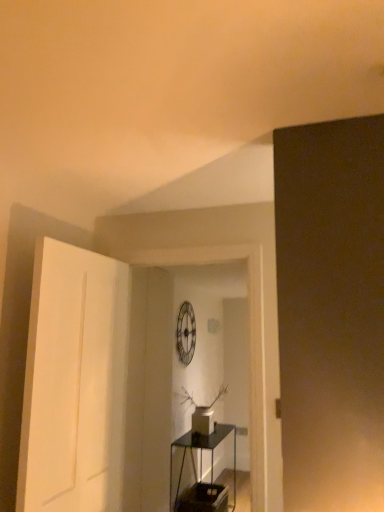
At what (x,y) coordinates should I click in order to perform the action: click on transparent glass table at center. Please return your answer as a coordinate pair (x, y). The height and width of the screenshot is (512, 384). Looking at the image, I should click on tap(200, 454).

What do you see at coordinates (200, 454) in the screenshot? I see `transparent glass table at center` at bounding box center [200, 454].

What do you see at coordinates (74, 382) in the screenshot? I see `white matte door at left` at bounding box center [74, 382].

In order to face white matte door at left, should I rotate leftwards or rightwards?

Turn left by 14.114 degrees to look at white matte door at left.

What is the approximate width of white matte door at left?

6.76 inches.

You are a GUI agent. You are given a task and a screenshot of the screen. Output one action in this format:
    pyautogui.click(x=<x>, y=<y>)
    Task: Click on the white matte door at left
    Image resolution: width=384 pixels, height=512 pixels.
    Given the screenshot: What is the action you would take?
    pyautogui.click(x=74, y=382)

What is the approximate height of white matte door at left?

white matte door at left is 4.36 feet in height.

The height and width of the screenshot is (512, 384). Find the location of `transparent glass table at center`. transparent glass table at center is located at coordinates pyautogui.click(x=200, y=454).

Between white matte door at left and transparent glass table at center, which one appears on the left side from the viewer's perspective?

Positioned to the left is white matte door at left.

Who is more distant, white matte door at left or transparent glass table at center?

transparent glass table at center is further from the camera.

Which is behind, point (119, 313) or point (192, 455)?

The point (192, 455) is more distant.

From the image's perspective, which is above, white matte door at left or transparent glass table at center?

white matte door at left.

From a real-world perspective, is white matte door at left physically below transparent glass table at center?

Incorrect, from a real-world perspective, white matte door at left is higher than transparent glass table at center.

Can you confirm if white matte door at left is wider than transparent glass table at center?

In fact, white matte door at left might be narrower than transparent glass table at center.

From the picture: Considering the sizes of objects white matte door at left and transparent glass table at center in the image provided, who is taller, white matte door at left or transparent glass table at center?

white matte door at left.

From the picture: Based on their sizes in the image, would you say white matte door at left is bigger or smaller than transparent glass table at center?

In the image, white matte door at left appears to be smaller than transparent glass table at center.

Is white matte door at left surrounding transparent glass table at center?

No, transparent glass table at center is not a part of white matte door at left.

Can you see white matte door at left touching transparent glass table at center?

No, white matte door at left is not making contact with transparent glass table at center.

Is white matte door at left facing towards transparent glass table at center?

No, white matte door at left is not aimed at transparent glass table at center.

Looking at this image, what's the angular difference between white matte door at left and transparent glass table at center's facing directions?

There is a 2.21-degree angle between the facing directions of white matte door at left and transparent glass table at center.

Locate an element on the screen. door above the transparent glass table at center (from the image's perspective) is located at coordinates (74, 382).

Considering the positions of objects transparent glass table at center and white matte door at left in the image provided, who is more to the left, transparent glass table at center or white matte door at left?

Positioned to the left is white matte door at left.

Which is behind, transparent glass table at center or white matte door at left?

transparent glass table at center is further away from the camera.

Considering the positions of points (191, 452) and (70, 445), is point (191, 452) closer to camera compared to point (70, 445)?

No, (191, 452) is further to viewer.

From the image's perspective, is transparent glass table at center located above white matte door at left?

No, from the image's perspective, transparent glass table at center is not on top of white matte door at left.

From a real-world perspective, which object rests below the other?

In real-world perspective, transparent glass table at center is lower.

Is transparent glass table at center wider than white matte door at left?

Yes.

Considering the sizes of objects transparent glass table at center and white matte door at left in the image provided, who is taller, transparent glass table at center or white matte door at left?

white matte door at left is taller.

Who is smaller, transparent glass table at center or white matte door at left?

white matte door at left is smaller.

Is transparent glass table at center completely or partially outside of white matte door at left?

Yes, transparent glass table at center is not within white matte door at left.

Consider the image. Is transparent glass table at center not near white matte door at left?

Yes.

Is transparent glass table at center oriented away from white matte door at left?

transparent glass table at center is not turned away from white matte door at left.

Where is `door that is in front of the transparent glass table at center`? Image resolution: width=384 pixels, height=512 pixels. door that is in front of the transparent glass table at center is located at coordinates (74, 382).

Where is `door that is above the transparent glass table at center (from a real-world perspective)`? The image size is (384, 512). door that is above the transparent glass table at center (from a real-world perspective) is located at coordinates (74, 382).

Where is `table that is under the white matte door at left (from a real-world perspective)`? table that is under the white matte door at left (from a real-world perspective) is located at coordinates tap(200, 454).